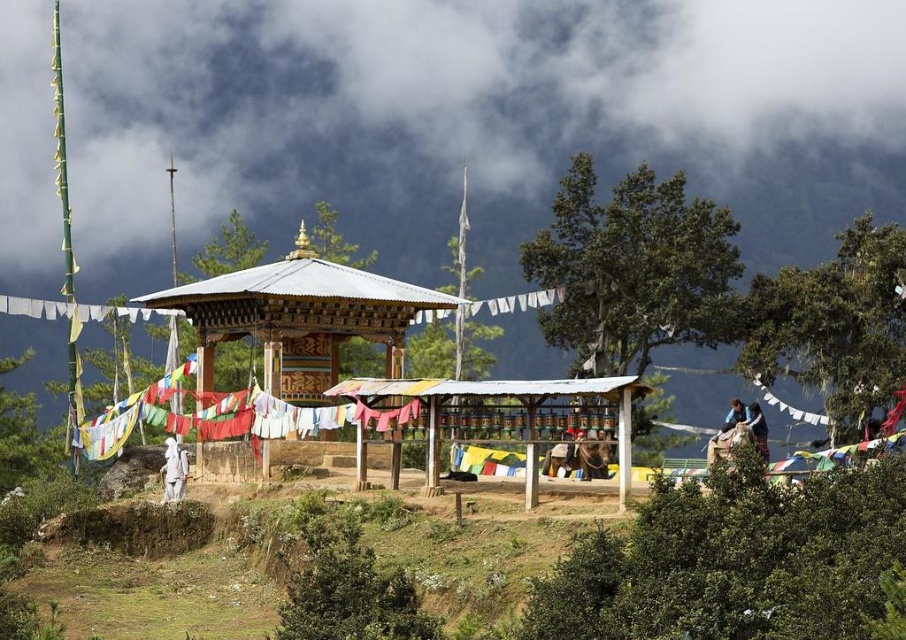
Does dark gray cloud at upper center appear over light brown leather jacket at upper right?

Yes.

Is dark gray cloud at upper center shorter than light brown leather jacket at upper right?

Incorrect, dark gray cloud at upper center's height does not fall short of light brown leather jacket at upper right's.

Is point (834, 230) closer to viewer compared to point (736, 412)?

No, (834, 230) is further to viewer.

The image size is (906, 640). I want to click on dark gray cloud at upper center, so click(x=474, y=116).

Can you confirm if green leafy bush at lower right is positioned to the right of light brown leather jacket at upper right?

In fact, green leafy bush at lower right is to the left of light brown leather jacket at upper right.

Is green leafy bush at lower right positioned before light brown leather jacket at upper right?

Yes.

Does point (606, 545) lie behind point (730, 426)?

That is False.

I want to click on green leafy bush at lower right, so click(x=733, y=561).

Is dark gray cloud at upper center above dark blue fabric at right?

Indeed, dark gray cloud at upper center is positioned over dark blue fabric at right.

Who is taller, dark gray cloud at upper center or dark blue fabric at right?

With more height is dark gray cloud at upper center.

Between point (51, 221) and point (757, 408), which one is positioned behind?

Point (51, 221)

Image resolution: width=906 pixels, height=640 pixels. I want to click on dark gray cloud at upper center, so click(474, 116).